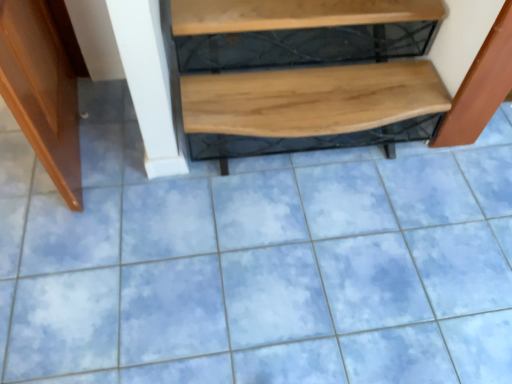
What are the coordinates of `unoccupied area in front of shiny brown door at left` in the screenshot? It's located at (82, 245).